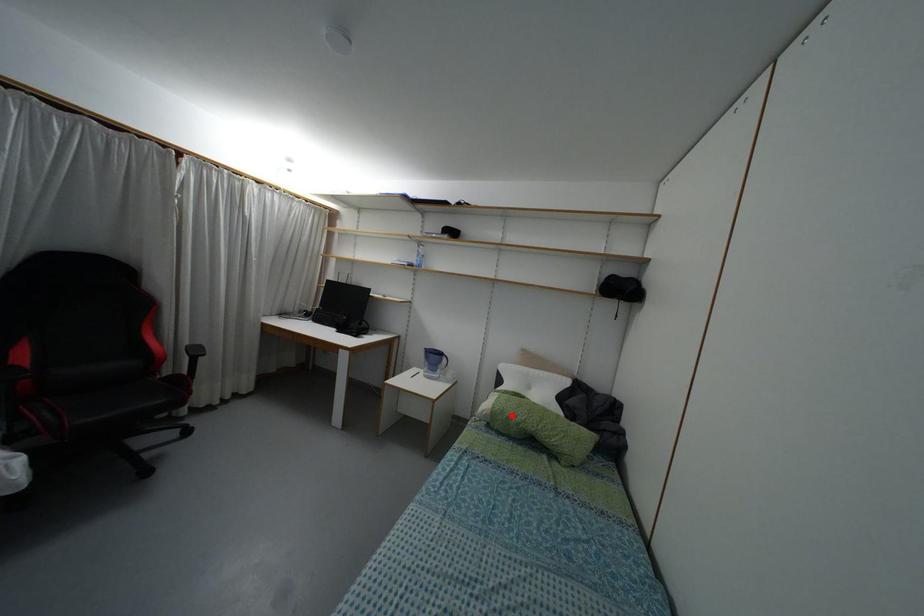
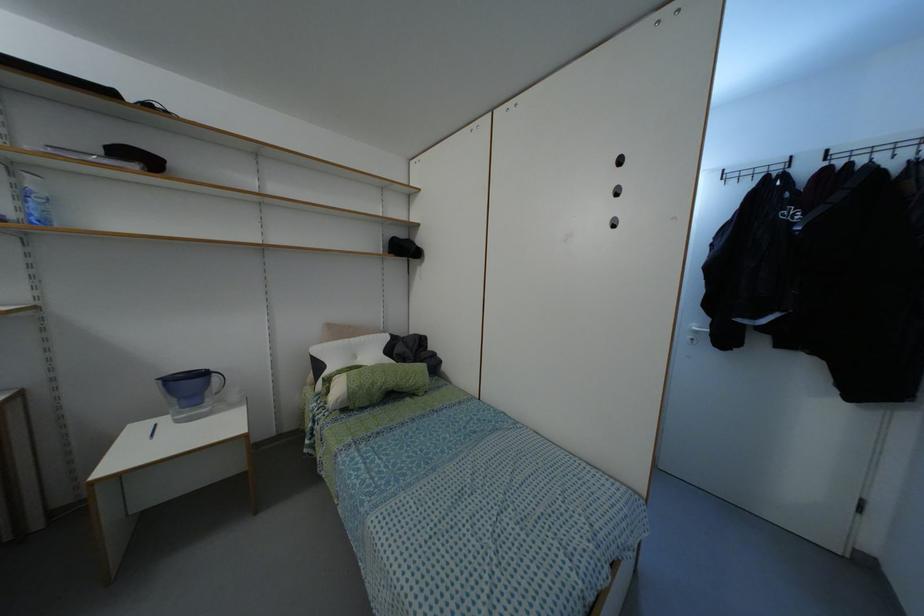
The point at the highlighted location is marked in the first image. Where is the corresponding point in the second image?

(371, 384)